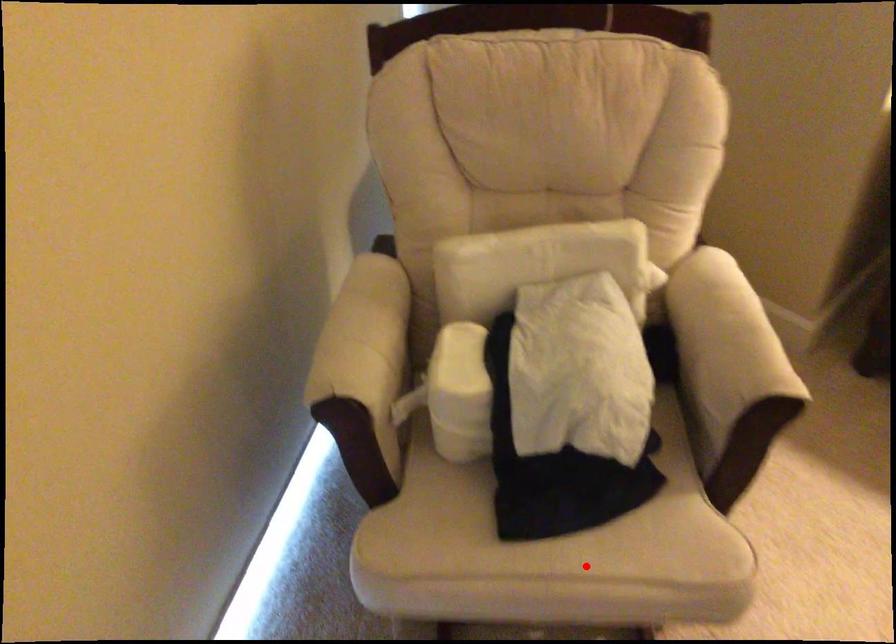
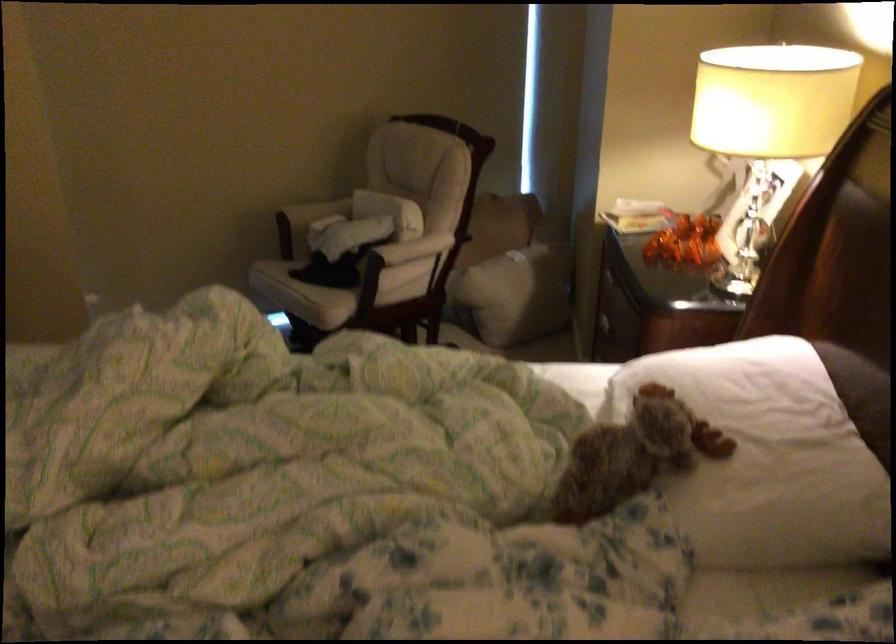
Where in the second image is the point corresponding to the highlighted location from the first image?

(291, 285)